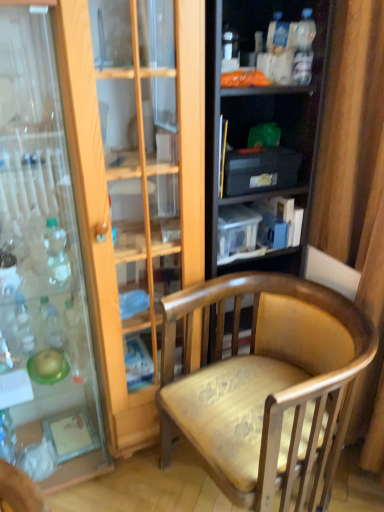
Question: Can you confirm if wooden armchair at center is positioned to the right of translucent plastic bottle at left, the 2th bottle positioned from the top?

Choices:
 (A) yes
 (B) no

Answer: (A)

Question: Is wooden armchair at center positioned before translucent plastic bottle at left, which appears as the first bottle when ordered from the bottom?

Choices:
 (A) yes
 (B) no

Answer: (A)

Question: Is wooden armchair at center behind translucent plastic bottle at left, the 1th bottle positioned from the left?

Choices:
 (A) no
 (B) yes

Answer: (A)

Question: From the image's perspective, is wooden armchair at center located beneath translucent plastic bottle at left, the 1th bottle positioned from the left?

Choices:
 (A) yes
 (B) no

Answer: (A)

Question: Is wooden armchair at center taller than translucent plastic bottle at left, which appears as the first bottle when ordered from the bottom?

Choices:
 (A) no
 (B) yes

Answer: (B)

Question: Would you say translucent plastic bottle at left, placed as the 2th bottle when sorted from right to left, is to the left or to the right of translucent plastic bottles at upper right, arranged as the 2th shelf when ordered from the bottom, in the picture?

Choices:
 (A) right
 (B) left

Answer: (B)

Question: Do you think translucent plastic bottle at left, placed as the 2th bottle when sorted from right to left, is within translucent plastic bottles at upper right, arranged as the 2th shelf when ordered from the bottom, or outside of it?

Choices:
 (A) inside
 (B) outside

Answer: (B)

Question: Is translucent plastic bottle at left, which appears as the 1th bottle when viewed from the back, taller or shorter than translucent plastic bottles at upper right, arranged as the 2th shelf when ordered from the bottom?

Choices:
 (A) short
 (B) tall

Answer: (A)

Question: From a real-world perspective, is translucent plastic bottle at left, the 2th bottle positioned from the top, positioned above or below translucent plastic bottles at upper right, acting as the first shelf starting from the top?

Choices:
 (A) below
 (B) above

Answer: (A)

Question: Based on their positions, is wooden armchair at center located to the left or right of translucent plastic bottle at left, the second bottle in the front-to-back sequence?

Choices:
 (A) left
 (B) right

Answer: (B)

Question: From a real-world perspective, relative to translucent plastic bottle at left, the 1th bottle positioned from the left, is wooden armchair at center vertically above or below?

Choices:
 (A) above
 (B) below

Answer: (B)

Question: From the image's perspective, is wooden armchair at center above or below translucent plastic bottle at left, which appears as the first bottle when ordered from the bottom?

Choices:
 (A) below
 (B) above

Answer: (A)

Question: From their relative heights in the image, would you say wooden armchair at center is taller or shorter than translucent plastic bottle at left, the 1th bottle positioned from the left?

Choices:
 (A) tall
 (B) short

Answer: (A)

Question: In terms of height, does black plastic storage at upper center, which ranks as the first shelf in bottom-to-top order, look taller or shorter compared to clear glass bottle at left, the second bottle viewed from the back?

Choices:
 (A) short
 (B) tall

Answer: (A)

Question: Looking at the image, does black plastic storage at upper center, which ranks as the first shelf in bottom-to-top order, seem bigger or smaller compared to clear glass bottle at left, the 2th bottle from the bottom?

Choices:
 (A) small
 (B) big

Answer: (B)